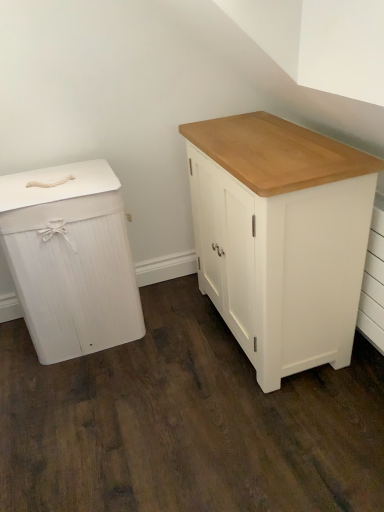
Question: Could you tell me if white wood chest of drawers at left, which is the second chest of drawers in right-to-left order, is turned towards white painted wood cabinet at center, the first chest of drawers viewed from the right?

Choices:
 (A) yes
 (B) no

Answer: (B)

Question: Can you confirm if white wood chest of drawers at left, the first chest of drawers positioned from the left, is wider than white painted wood cabinet at center, the first chest of drawers viewed from the right?

Choices:
 (A) yes
 (B) no

Answer: (A)

Question: Considering the relative sizes of white wood chest of drawers at left, the first chest of drawers positioned from the left, and white painted wood cabinet at center, which is the 2th chest of drawers from left to right, in the image provided, is white wood chest of drawers at left, the first chest of drawers positioned from the left, shorter than white painted wood cabinet at center, which is the 2th chest of drawers from left to right,?

Choices:
 (A) no
 (B) yes

Answer: (B)

Question: Is white wood chest of drawers at left, the first chest of drawers positioned from the left, smaller than white painted wood cabinet at center, which is the 2th chest of drawers from left to right?

Choices:
 (A) no
 (B) yes

Answer: (B)

Question: Are white wood chest of drawers at left, the first chest of drawers positioned from the left, and white painted wood cabinet at center, the first chest of drawers viewed from the right, located far from each other?

Choices:
 (A) no
 (B) yes

Answer: (A)

Question: From a real-world perspective, is white wood chest of drawers at left, which is the second chest of drawers in right-to-left order, below white painted wood cabinet at center, which is the 2th chest of drawers from left to right?

Choices:
 (A) yes
 (B) no

Answer: (A)

Question: Can you confirm if white painted wood cabinet at center, which is the 2th chest of drawers from left to right, is positioned to the left of white wood chest of drawers at left, which is the second chest of drawers in right-to-left order?

Choices:
 (A) yes
 (B) no

Answer: (B)

Question: Is white painted wood cabinet at center, the first chest of drawers viewed from the right, beside white wood chest of drawers at left, the first chest of drawers positioned from the left?

Choices:
 (A) no
 (B) yes

Answer: (A)

Question: Considering the relative sizes of white painted wood cabinet at center, the first chest of drawers viewed from the right, and white wood chest of drawers at left, the first chest of drawers positioned from the left, in the image provided, is white painted wood cabinet at center, the first chest of drawers viewed from the right, smaller than white wood chest of drawers at left, the first chest of drawers positioned from the left,?

Choices:
 (A) no
 (B) yes

Answer: (A)

Question: Is white painted wood cabinet at center, which is the 2th chest of drawers from left to right, behind white wood chest of drawers at left, which is the second chest of drawers in right-to-left order?

Choices:
 (A) yes
 (B) no

Answer: (B)

Question: Is white painted wood cabinet at center, the first chest of drawers viewed from the right, oriented towards white wood chest of drawers at left, the first chest of drawers positioned from the left?

Choices:
 (A) no
 (B) yes

Answer: (B)

Question: From the image's perspective, is white painted wood cabinet at center, the first chest of drawers viewed from the right, above white wood chest of drawers at left, the first chest of drawers positioned from the left?

Choices:
 (A) no
 (B) yes

Answer: (B)

Question: Considering the positions of white wood chest of drawers at left, the first chest of drawers positioned from the left, and white painted wood cabinet at center, the first chest of drawers viewed from the right, in the image, is white wood chest of drawers at left, the first chest of drawers positioned from the left, bigger or smaller than white painted wood cabinet at center, the first chest of drawers viewed from the right,?

Choices:
 (A) big
 (B) small

Answer: (B)